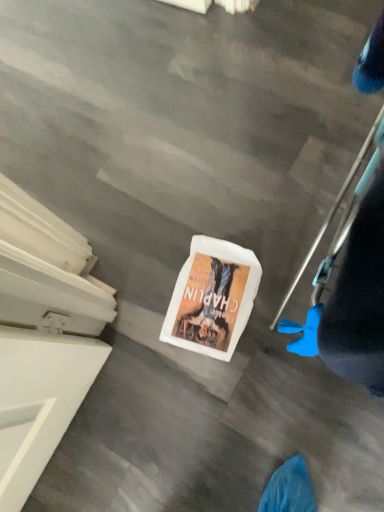
Identify the location of vacant space in white matte book at center (from a real-world perspective). (210, 292).